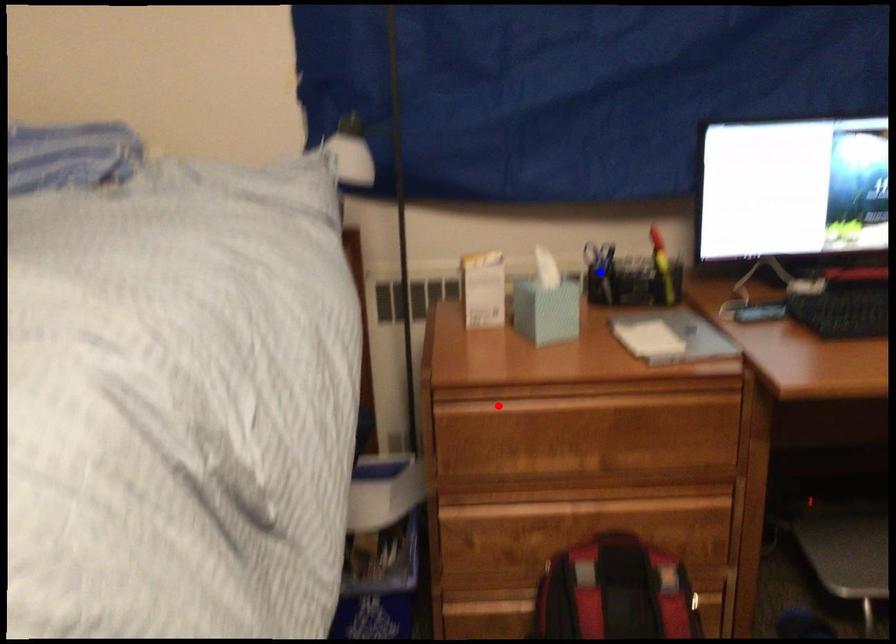
Question: Which of the two points in the image is closer to the camera?

Choices:
 (A) Blue point is closer.
 (B) Red point is closer.

Answer: (B)